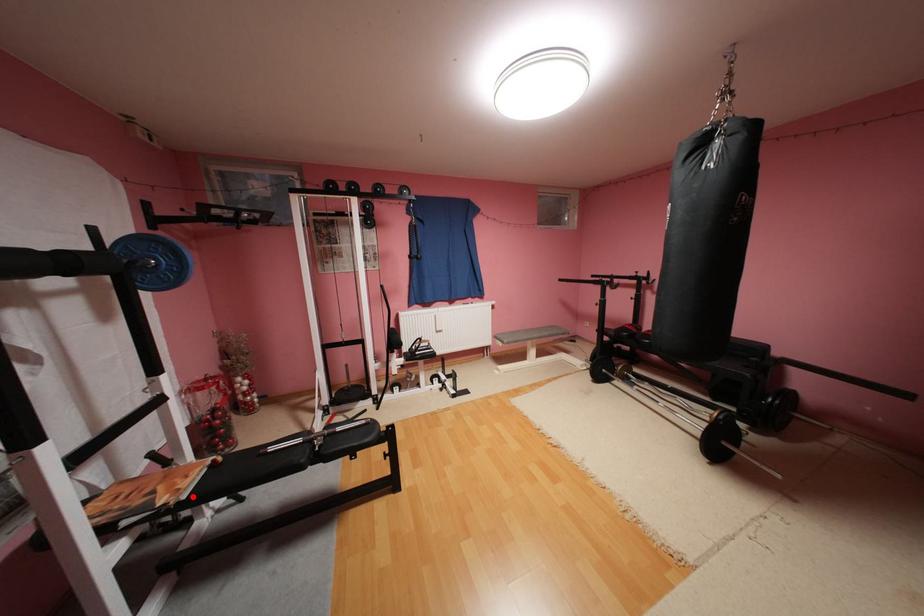
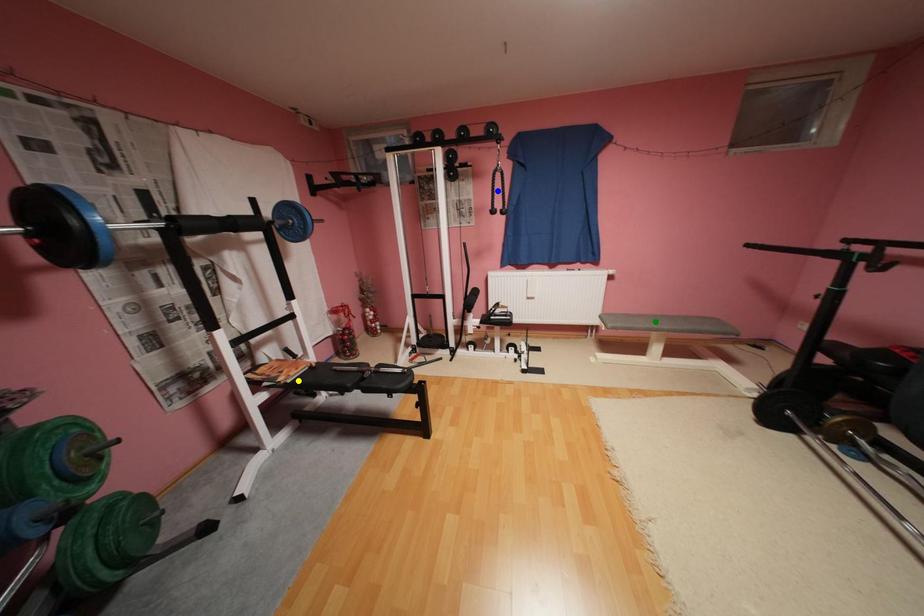
Question: I am providing you with two images of the same scene from different viewpoints. A red point is marked on the first image. You are given multiple points on the second image. Which mark in image 2 goes with the point in image 1?

Choices:
 (A) blue point
 (B) green point
 (C) yellow point

Answer: (C)